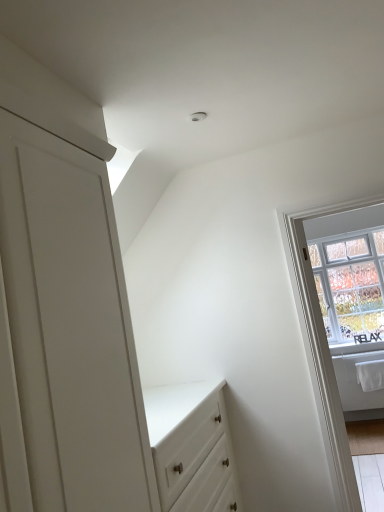
In order to face white plastic window frame at right, should I rotate leftwards or rightwards?

Rotate your view right by about 23.074°.

Locate an element on the screen. This screenshot has height=512, width=384. white plastic window frame at right is located at coordinates (323, 358).

What do you see at coordinates (323, 358) in the screenshot? I see `white plastic window frame at right` at bounding box center [323, 358].

Identify the location of clear glass window at upper right. The image size is (384, 512). (349, 276).

Measure the distance between clear glass window at upper right and camera.

The distance of clear glass window at upper right from camera is 2.25 meters.

What do you see at coordinates (349, 276) in the screenshot?
I see `clear glass window at upper right` at bounding box center [349, 276].

The height and width of the screenshot is (512, 384). Find the location of `white plastic window frame at right`. white plastic window frame at right is located at coordinates (323, 358).

Would you say clear glass window at upper right is to the left or to the right of white plastic window frame at right in the picture?

Clearly, clear glass window at upper right is on the right of white plastic window frame at right in the image.

Which object is further away from the camera, clear glass window at upper right or white plastic window frame at right?

clear glass window at upper right is behind.

Considering the positions of points (365, 239) and (328, 371), is point (365, 239) closer to camera compared to point (328, 371)?

No, (365, 239) is behind (328, 371).

From the image's perspective, which one is positioned lower, clear glass window at upper right or white plastic window frame at right?

white plastic window frame at right appears lower in the image.

From a real-world perspective, is clear glass window at upper right beneath white plastic window frame at right?

Actually, clear glass window at upper right is physically above white plastic window frame at right in the real world.

Considering the sizes of objects clear glass window at upper right and white plastic window frame at right in the image provided, who is thinner, clear glass window at upper right or white plastic window frame at right?

white plastic window frame at right.

Considering the relative sizes of clear glass window at upper right and white plastic window frame at right in the image provided, is clear glass window at upper right shorter than white plastic window frame at right?

Correct, clear glass window at upper right is not as tall as white plastic window frame at right.

Consider the image. Which of these two, clear glass window at upper right or white plastic window frame at right, is bigger?

With larger size is clear glass window at upper right.

Is clear glass window at upper right situated inside white plastic window frame at right or outside?

clear glass window at upper right is not enclosed by white plastic window frame at right.

Looking at this image, are clear glass window at upper right and white plastic window frame at right beside each other?

No, clear glass window at upper right is not beside white plastic window frame at right.

Is clear glass window at upper right aimed at white plastic window frame at right?

Yes, clear glass window at upper right is turned towards white plastic window frame at right.

How many degrees apart are the facing directions of clear glass window at upper right and white plastic window frame at right?

The angular difference between clear glass window at upper right and white plastic window frame at right is 0.168 degrees.

Where is `window positioned vertically above the white plastic window frame at right (from a real-world perspective)`? The width and height of the screenshot is (384, 512). window positioned vertically above the white plastic window frame at right (from a real-world perspective) is located at coordinates (349, 276).

Is white plastic window frame at right at the right side of clear glass window at upper right?

In fact, white plastic window frame at right is to the left of clear glass window at upper right.

Relative to clear glass window at upper right, is white plastic window frame at right in front or behind?

In the image, white plastic window frame at right appears in front of clear glass window at upper right.

Does point (302, 292) appear closer or farther from the camera than point (350, 334)?

Point (302, 292) is positioned closer to the camera compared to point (350, 334).

From the image's perspective, which is above, white plastic window frame at right or clear glass window at upper right?

clear glass window at upper right, from the image's perspective.

From a real-world perspective, does white plastic window frame at right stand above clear glass window at upper right?

No, from a real-world perspective, white plastic window frame at right is not above clear glass window at upper right.

Between white plastic window frame at right and clear glass window at upper right, which one has smaller width?

With smaller width is white plastic window frame at right.

Consider the image. Considering the sizes of white plastic window frame at right and clear glass window at upper right in the image, is white plastic window frame at right taller or shorter than clear glass window at upper right?

Clearly, white plastic window frame at right is taller compared to clear glass window at upper right.

Considering the sizes of objects white plastic window frame at right and clear glass window at upper right in the image provided, who is bigger, white plastic window frame at right or clear glass window at upper right?

clear glass window at upper right.

Is white plastic window frame at right spatially inside clear glass window at upper right, or outside of it?

white plastic window frame at right cannot be found inside clear glass window at upper right.

Is there a large distance between white plastic window frame at right and clear glass window at upper right?

They are positioned close to each other.

Is white plastic window frame at right facing away from clear glass window at upper right?

Yes.

In order to click on window frame that is in front of the clear glass window at upper right in this screenshot , I will do point(323,358).

At what (x,y) coordinates should I click in order to perform the action: click on window on the right of the white plastic window frame at right. Please return your answer as a coordinate pair (x, y). The width and height of the screenshot is (384, 512). Looking at the image, I should click on (349, 276).

The height and width of the screenshot is (512, 384). Find the location of `window frame on the left of clear glass window at upper right`. window frame on the left of clear glass window at upper right is located at coordinates (323, 358).